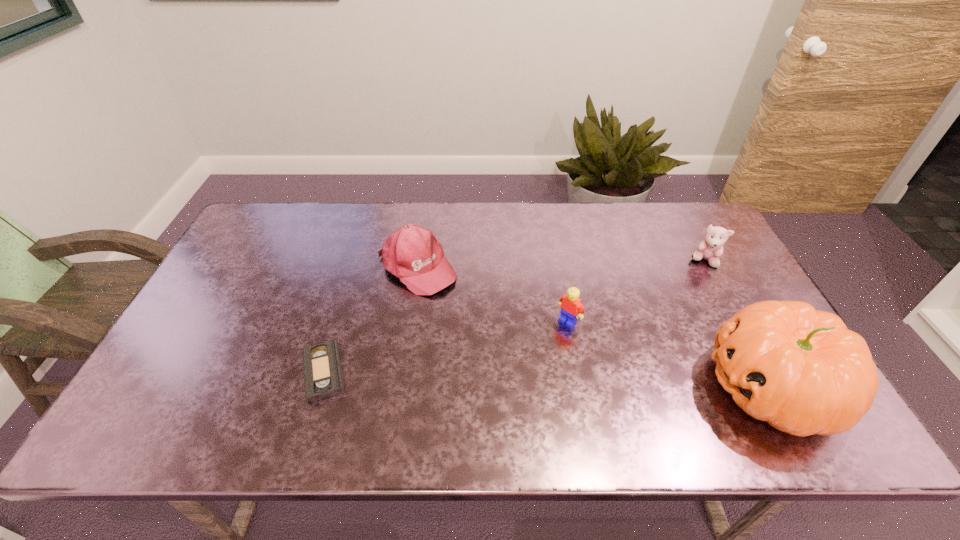
The image size is (960, 540). I want to click on the shortest object, so (x=323, y=376).

The height and width of the screenshot is (540, 960). Find the location of `the tallest object`. the tallest object is located at coordinates (801, 370).

Where is `Lego`? Image resolution: width=960 pixels, height=540 pixels. Lego is located at coordinates (571, 308).

At what (x,y) coordinates should I click in order to perform the action: click on the third object from left to right. Please return your answer as a coordinate pair (x, y). Image resolution: width=960 pixels, height=540 pixels. Looking at the image, I should click on (571, 308).

The image size is (960, 540). What are the coordinates of `teddy bear` in the screenshot? It's located at (711, 248).

Locate an element on the screen. The height and width of the screenshot is (540, 960). baseball cap is located at coordinates (412, 253).

Find the location of a particular element. free space located 0.350m on the left of the shortest object is located at coordinates (156, 372).

Find the location of a particular element. free space located on the carved face of the tallest object is located at coordinates (585, 386).

Where is `blank space located 0.060m on the carved face of the tallest object`? This screenshot has height=540, width=960. blank space located 0.060m on the carved face of the tallest object is located at coordinates point(681,386).

What are the coordinates of `free space located 0.390m on the carved face of the tallest object` in the screenshot? It's located at (543, 386).